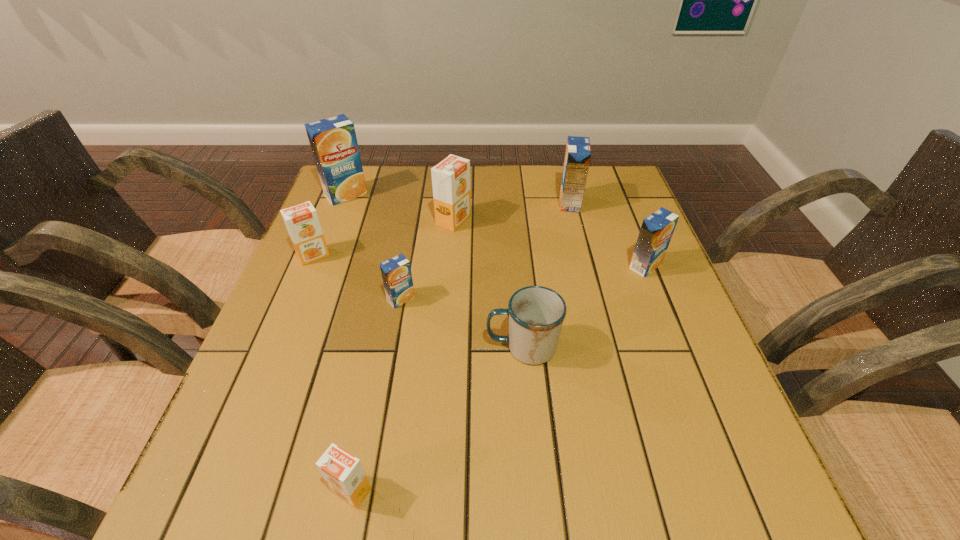
The height and width of the screenshot is (540, 960). I want to click on blue orange_juice that stands as the second closest to the second nearest object, so click(x=657, y=229).

Identify which blue orange_juice is the closest to the nearest blue orange_juice. Please provide its 2D coordinates. Your answer should be formatted as a tuple, i.e. [(x, y)], where the tuple contains the x and y coordinates of a point satisfying the conditions above.

[(333, 141)]

The image size is (960, 540). What are the coordinates of `orange orange juice that is the closest to the biggest blue orange_juice` in the screenshot? It's located at pos(302,223).

Identify the location of orange orange juice that can be found as the third closest to the sixth farthest object. (344, 474).

Image resolution: width=960 pixels, height=540 pixels. In order to click on vacant space that satisfies the following two spatial constraints: 1. on the front side of the seventh object from left to right; 2. on the handle side of the mug in this screenshot , I will do `click(607, 347)`.

Where is `free spot that satisfies the following two spatial constraints: 1. on the back side of the second nearest orange orange juice; 2. on the left side of the second blue orange_juice from right to left`? The width and height of the screenshot is (960, 540). free spot that satisfies the following two spatial constraints: 1. on the back side of the second nearest orange orange juice; 2. on the left side of the second blue orange_juice from right to left is located at coordinates (335, 203).